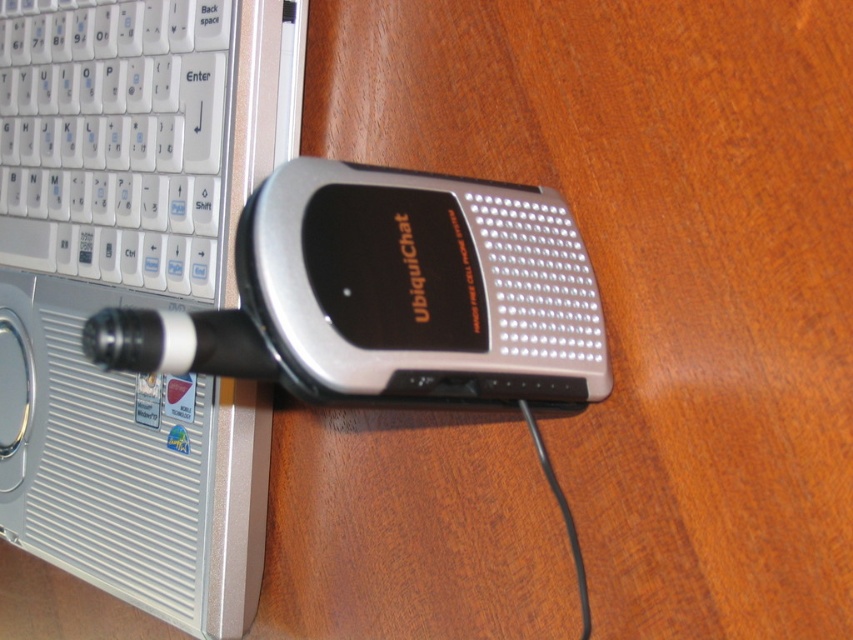
You are setting up a workstation and need to place the silver metallic laptop at left and the white plastic keyboard at upper left. Based on their positions, which object is closer to you?

The silver metallic laptop at left is closer to the viewer than the white plastic keyboard at upper left, so the silver metallic laptop at left is closer to you.

You are holding a UbiquiChat device and want to place it on the silver metallic laptop at left. Where should you place it so that it aligns with the point at coordinates point (135, 288)?

The point (135, 288) is already on the silver metallic laptop at left, so you can place the UbiquiChat device directly at that point to align it.

From the picture: You are setting up a workstation and need to place the silver metallic laptop at left and the white plastic keyboard at upper left. What is the minimum distance you need to leave between them to ensure they are properly positioned?

The silver metallic laptop at left is 1.53 inches away from the white plastic keyboard at upper left, so you should leave at least 1.53 inches between them to ensure proper positioning.